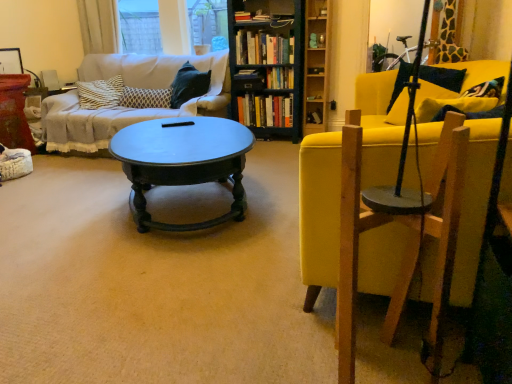
You are a GUI agent. You are given a task and a screenshot of the screen. Output one action in this format:
    pyautogui.click(x=<x>, y=<y>)
    Task: Click on the free space between shiny dark wood coffee table at center and wooden swivel chair at right
    The height and width of the screenshot is (384, 512).
    Given the screenshot: What is the action you would take?
    pyautogui.click(x=240, y=273)